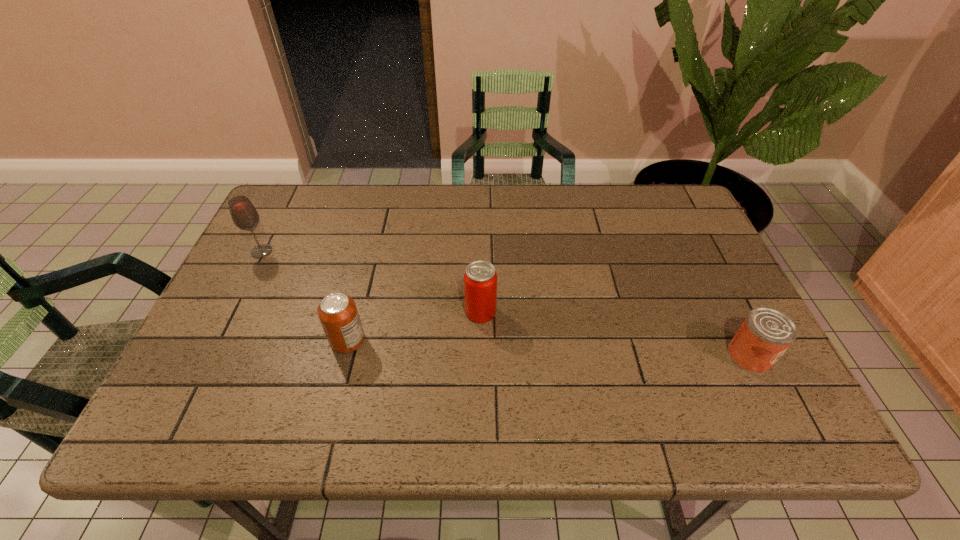
Where is `the second closest object to the second farthest object`? The image size is (960, 540). the second closest object to the second farthest object is located at coordinates (766, 333).

Locate an element on the screen. This screenshot has width=960, height=540. object that stands as the closest to the second can from right to left is located at coordinates [338, 314].

Identify which can is the second nearest to the leftmost object. Please provide its 2D coordinates. Your answer should be formatted as a tuple, i.e. [(x, y)], where the tuple contains the x and y coordinates of a point satisfying the conditions above.

[(480, 279)]

Locate which can ranks in proximity to the shortest object. Please provide its 2D coordinates. Your answer should be formatted as a tuple, i.e. [(x, y)], where the tuple contains the x and y coordinates of a point satisfying the conditions above.

[(480, 279)]

At what (x,y) coordinates should I click in order to perform the action: click on vacant space that satisfies the following two spatial constraints: 1. on the front side of the leftmost can; 2. on the left side of the tallest object. Please return your answer as a coordinate pair (x, y). This screenshot has width=960, height=540. Looking at the image, I should click on (217, 341).

This screenshot has height=540, width=960. What are the coordinates of `vacant area in the image that satisfies the following two spatial constraints: 1. on the back side of the second can from right to left; 2. on the left side of the second object from left to right` in the screenshot? It's located at (355, 312).